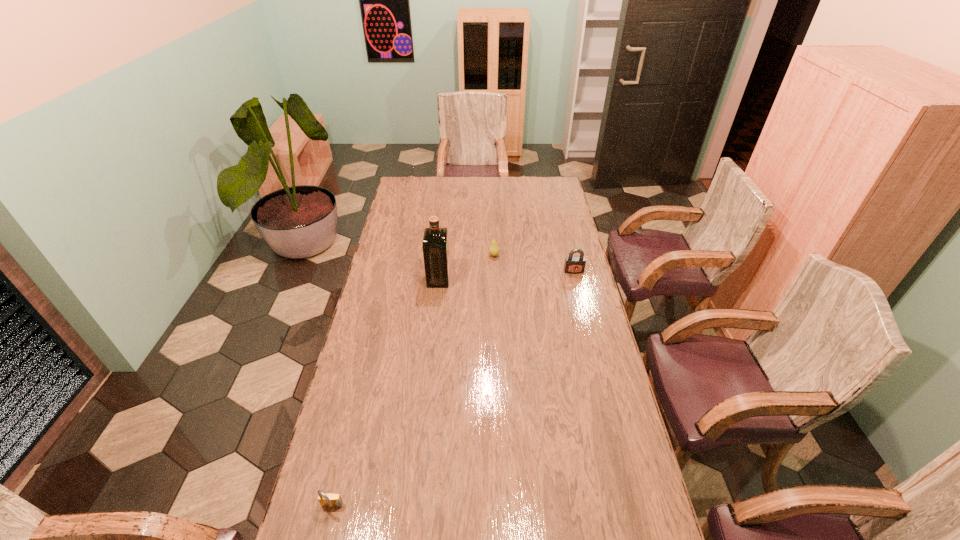
Image resolution: width=960 pixels, height=540 pixels. Find the location of `free location located 0.100m on the left of the pear`. free location located 0.100m on the left of the pear is located at coordinates (467, 255).

Image resolution: width=960 pixels, height=540 pixels. Find the location of `object that is at the left edge`. object that is at the left edge is located at coordinates (329, 500).

The image size is (960, 540). What are the coordinates of `object that is at the right edge` in the screenshot? It's located at (573, 264).

I want to click on free location at the far edge, so click(505, 179).

The height and width of the screenshot is (540, 960). Identify the location of free space at the left edge of the desktop. (378, 261).

In the image, there is a desktop. Where is `vacant space at the right edge`? The height and width of the screenshot is (540, 960). vacant space at the right edge is located at coordinates (610, 413).

Locate an element on the screen. The width and height of the screenshot is (960, 540). empty space between the second object from right to left and the nearer padlock is located at coordinates (413, 382).

The image size is (960, 540). Find the location of `empty location between the second object from left to right and the rightmost object`. empty location between the second object from left to right and the rightmost object is located at coordinates (506, 275).

Identify the location of vacant space in between the liquor and the right padlock. (506, 275).

I want to click on empty location between the taller padlock and the second object from right to left, so click(x=534, y=264).